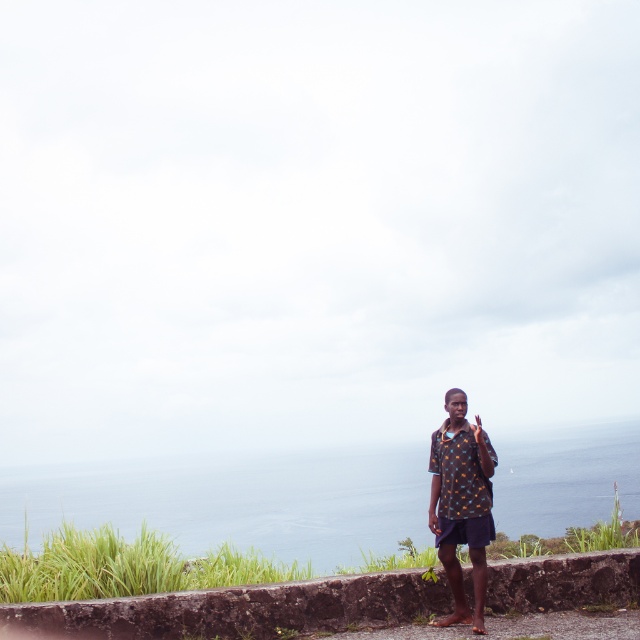
Question: Among these points, which one is farthest from the camera?

Choices:
 (A) (557, 504)
 (B) (444, 625)
 (C) (596, 589)

Answer: (A)

Question: Which point appears closest to the camera in this image?

Choices:
 (A) (192, 589)
 (B) (417, 532)

Answer: (A)

Question: Is rustic stone ledge at lower right above printed fabric shirt at center?

Choices:
 (A) no
 (B) yes

Answer: (A)

Question: Does rustic stone ledge at lower right appear on the right side of printed fabric shirt at center?

Choices:
 (A) no
 (B) yes

Answer: (A)

Question: Which point is farther from the camera taking this photo?

Choices:
 (A) (131, 464)
 (B) (470, 532)
 (C) (564, 609)

Answer: (A)

Question: In this image, where is blue water at center located relative to rustic stone ledge at lower right?

Choices:
 (A) left
 (B) right

Answer: (B)